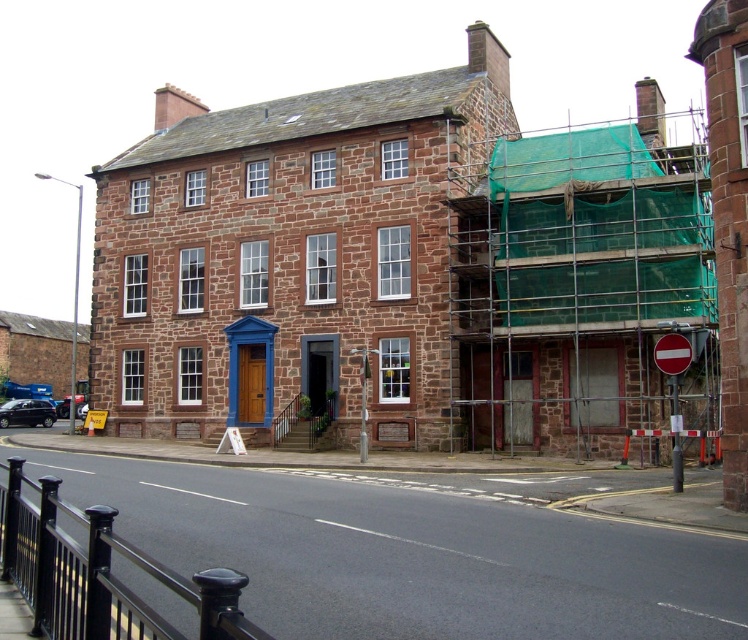
Is green mesh scaffolding at right below red glossy stop sign at center right?

No, green mesh scaffolding at right is not below red glossy stop sign at center right.

Is green mesh scaffolding at right above red glossy stop sign at center right?

Correct, green mesh scaffolding at right is located above red glossy stop sign at center right.

The width and height of the screenshot is (748, 640). I want to click on green mesh scaffolding at right, so click(x=579, y=284).

Does red plastic sign at lower right have a greater width compared to red glossy stop sign at center right?

No.

Between point (678, 476) and point (669, 374), which one is positioned in front?

Positioned in front is point (669, 374).

Does point (675, 368) lie in front of point (683, 342)?

Yes, point (675, 368) is closer to viewer.

This screenshot has width=748, height=640. Find the location of `red plastic sign at lower right`. red plastic sign at lower right is located at coordinates (674, 390).

Which of these two, green mesh scaffolding at right or red plastic sign at lower right, stands taller?

Standing taller between the two is green mesh scaffolding at right.

Is green mesh scaffolding at right taller than red plastic sign at lower right?

Yes, green mesh scaffolding at right is taller than red plastic sign at lower right.

Who is more forward, (598, 227) or (690, 355)?

Point (690, 355) is in front.

At what (x,y) coordinates should I click in order to perform the action: click on green mesh scaffolding at right. Please return your answer as a coordinate pair (x, y). The height and width of the screenshot is (640, 748). Looking at the image, I should click on click(x=579, y=284).